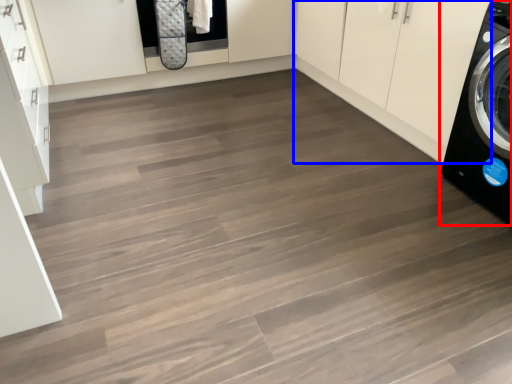
Question: Among these objects, which one is nearest to the camera, washing machine (highlighted by a red box) or cabinetry (highlighted by a blue box)?

Choices:
 (A) washing machine
 (B) cabinetry

Answer: (A)